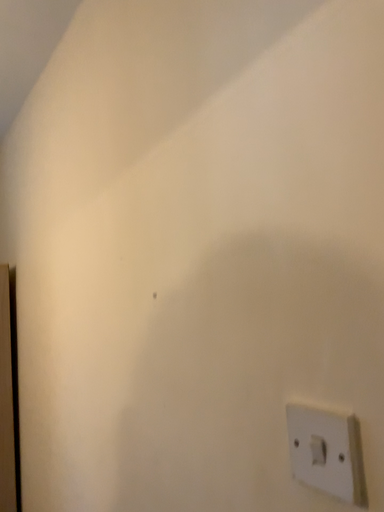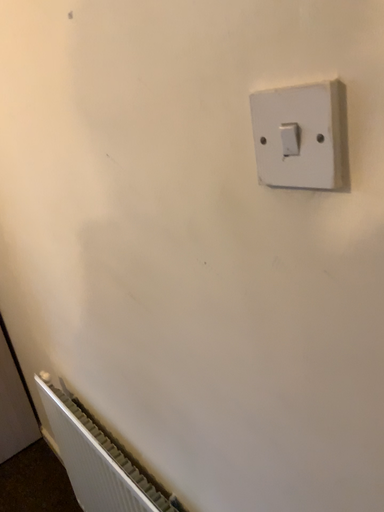
Question: How did the camera likely rotate when shooting the video?

Choices:
 (A) rotated upward
 (B) rotated downward

Answer: (B)